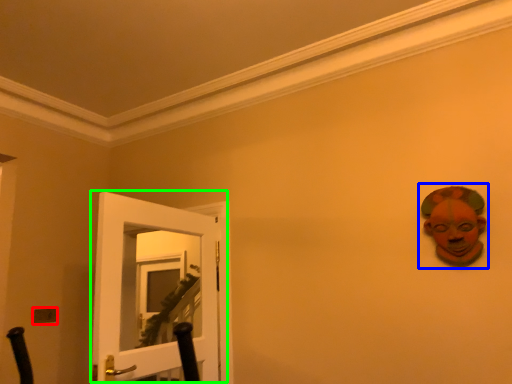
Question: Considering the real-world distances, which object is farthest from light switch (highlighted by a red box)? person (highlighted by a blue box) or door (highlighted by a green box)?

Choices:
 (A) person
 (B) door

Answer: (A)